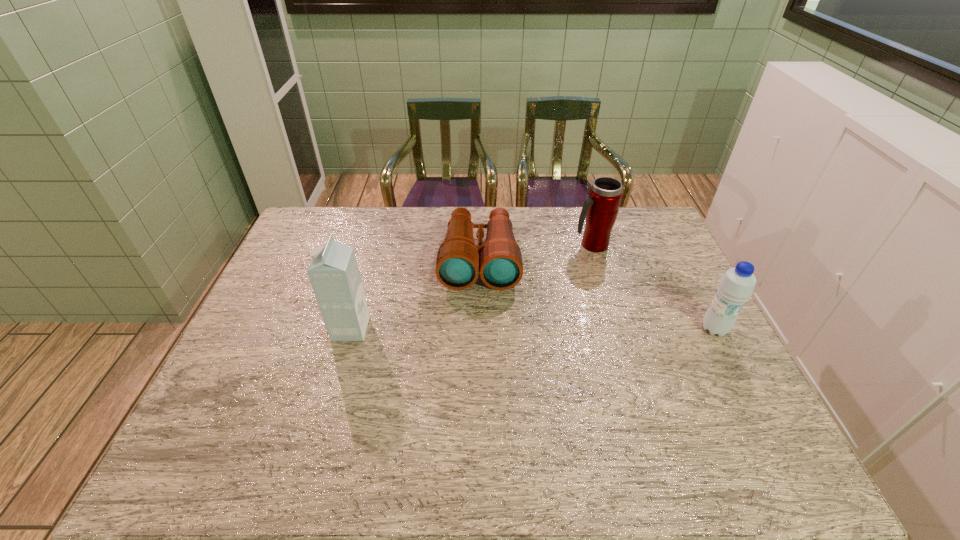
Locate an element on the screen. The width and height of the screenshot is (960, 540). blank area at the near edge is located at coordinates (449, 400).

The image size is (960, 540). I want to click on free space at the left edge, so click(x=304, y=282).

The width and height of the screenshot is (960, 540). In order to click on free region at the far left corner in this screenshot , I will do `click(349, 210)`.

In the image, there is a desktop. Where is `vacant space at the near left corner`? This screenshot has height=540, width=960. vacant space at the near left corner is located at coordinates (251, 404).

Image resolution: width=960 pixels, height=540 pixels. What are the coordinates of `vacant space at the far right corner` in the screenshot? It's located at (644, 225).

At what (x,y) coordinates should I click in order to perform the action: click on vacant point located between the shortest object and the tallest object. Please return your answer as a coordinate pair (x, y). The image size is (960, 540). Looking at the image, I should click on (415, 294).

Find the location of a particular element. The height and width of the screenshot is (540, 960). free area in between the thermos bottle and the water bottle is located at coordinates (653, 287).

Locate an element on the screen. The width and height of the screenshot is (960, 540). empty location between the shortest object and the rightmost object is located at coordinates (597, 294).

Locate an element on the screen. Image resolution: width=960 pixels, height=540 pixels. free space between the binoculars and the water bottle is located at coordinates (597, 294).

This screenshot has height=540, width=960. Find the location of `free space between the thermos bottle and the rightmost object`. free space between the thermos bottle and the rightmost object is located at coordinates (653, 287).